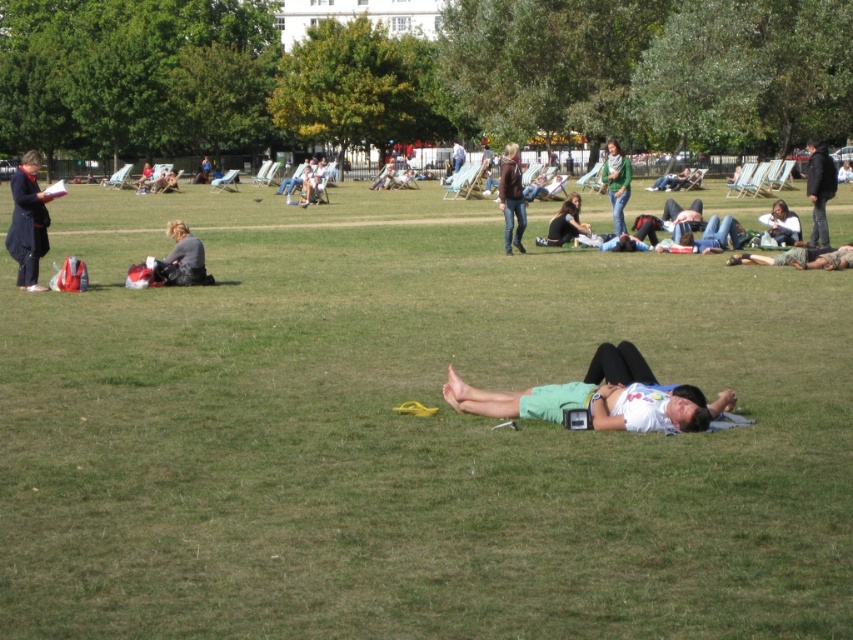
Question: Does white matte shirt at center have a smaller size compared to dark blue jacket at left?

Choices:
 (A) yes
 (B) no

Answer: (A)

Question: Which point is closer to the camera?

Choices:
 (A) dark blue jacket at left
 (B) matte black jacket at center
 (C) green grass at center

Answer: (C)

Question: Is dark blue jacket at right closer to camera compared to matte black jacket at center?

Choices:
 (A) no
 (B) yes

Answer: (B)

Question: Considering the real-world distances, which object is closest to the green grass at center?

Choices:
 (A) green knitted sweater at center
 (B) white matte shirt at center

Answer: (B)

Question: Does dark blue jacket at left lie in front of green knitted sweater at center?

Choices:
 (A) no
 (B) yes

Answer: (B)

Question: Which point is closer to the camera?

Choices:
 (A) (555, 241)
 (B) (434, 506)

Answer: (B)